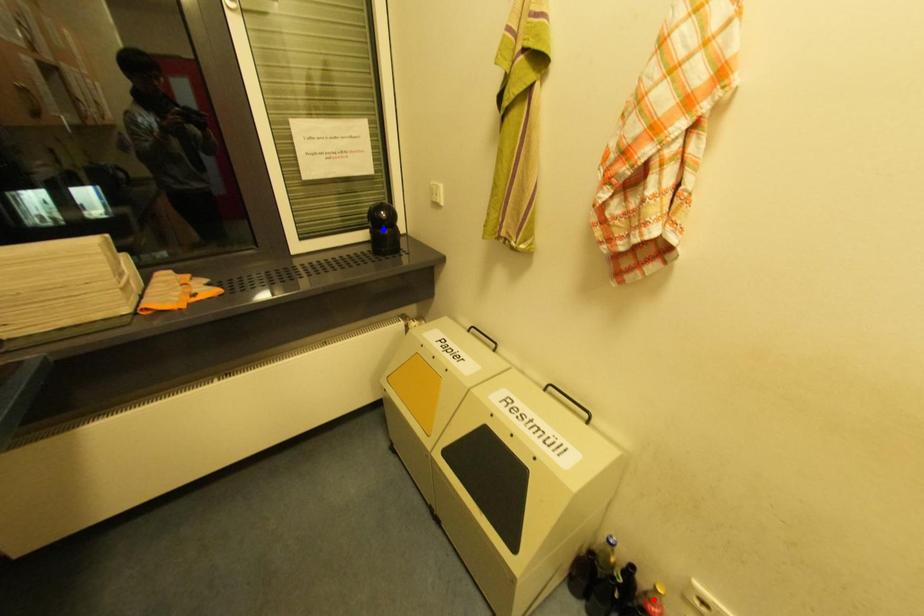
Question: Two points are marked on the image. Which point is closer to the camera?

Choices:
 (A) Blue point is closer.
 (B) Red point is closer.

Answer: (B)